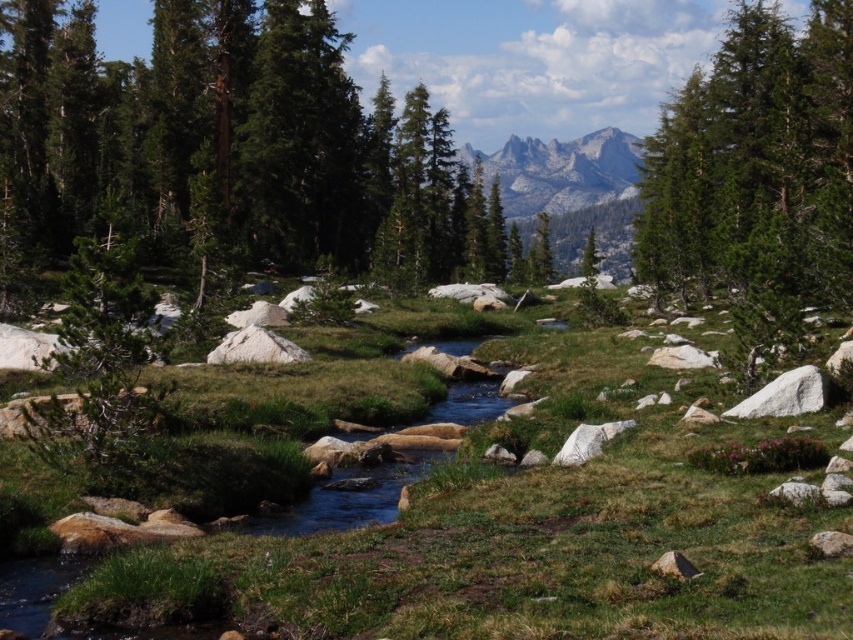
You are a hiker standing in the meadow and looking towards the green textured tree at upper right and the gray rocky mountain at upper center. Which object would appear closer to you based on their sizes in the image?

The green textured tree at upper right appears closer because it is bigger than the gray rocky mountain at upper center in the image.

You are a hiker standing at the edge of the stream in the meadow. You want to take a photo of the green textured tree at upper right and the gray rocky mountain at upper center. Which object will appear larger in your photo?

The green textured tree at upper right will appear larger in the photo because it is closer to you than the gray rocky mountain at upper center, making it appear bigger in the frame.

You are planning a hiking route and need to decide whether to go around the green textured tree at upper right or the gray rocky mountain at upper center first. Based on their positions, which one should you approach first?

The green textured tree at upper right is positioned under the gray rocky mountain at upper center, so you should approach the gray rocky mountain at upper center first before reaching the green textured tree at upper right.